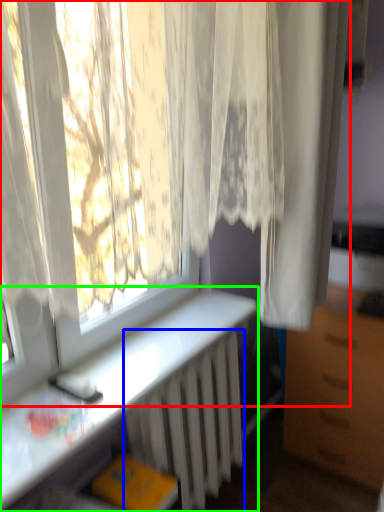
Question: Which object is the closest to the curtain (highlighted by a red box)? Choose among these: radiator (highlighted by a blue box) or desk (highlighted by a green box).

Choices:
 (A) radiator
 (B) desk

Answer: (B)